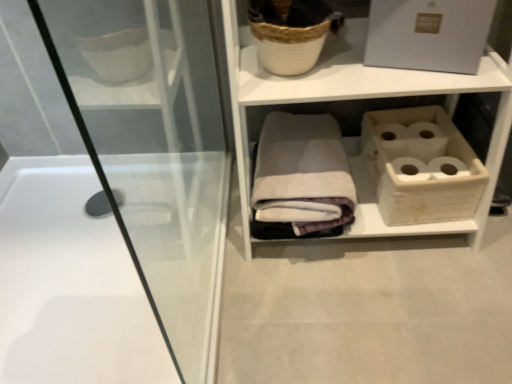
Question: Is white glossy bathtub at left further to camera compared to white woven basket at upper center?

Choices:
 (A) yes
 (B) no

Answer: (A)

Question: Considering the relative positions of white glossy bathtub at left and white woven basket at upper center in the image provided, is white glossy bathtub at left to the left of white woven basket at upper center from the viewer's perspective?

Choices:
 (A) no
 (B) yes

Answer: (B)

Question: Is white glossy bathtub at left aimed at white woven basket at upper center?

Choices:
 (A) no
 (B) yes

Answer: (A)

Question: Is white glossy bathtub at left positioned before white woven basket at upper center?

Choices:
 (A) yes
 (B) no

Answer: (B)

Question: Considering the relative sizes of white glossy bathtub at left and white woven basket at upper center in the image provided, is white glossy bathtub at left bigger than white woven basket at upper center?

Choices:
 (A) no
 (B) yes

Answer: (A)

Question: Is white glossy bathtub at left taller than white woven basket at upper center?

Choices:
 (A) yes
 (B) no

Answer: (B)

Question: From a real-world perspective, does white woven basket at upper center stand above white glossy bathtub at left?

Choices:
 (A) no
 (B) yes

Answer: (B)

Question: From a real-world perspective, is white woven basket at upper center beneath white glossy bathtub at left?

Choices:
 (A) no
 (B) yes

Answer: (A)

Question: Does white woven basket at upper center have a smaller size compared to white glossy bathtub at left?

Choices:
 (A) no
 (B) yes

Answer: (A)

Question: Is white woven basket at upper center turned away from white glossy bathtub at left?

Choices:
 (A) yes
 (B) no

Answer: (B)

Question: Is white woven basket at upper center shorter than white glossy bathtub at left?

Choices:
 (A) no
 (B) yes

Answer: (A)

Question: Is white woven basket at upper center located outside white glossy bathtub at left?

Choices:
 (A) yes
 (B) no

Answer: (A)

Question: Is gray cotton bath towel at center located within white glossy bathtub at left?

Choices:
 (A) no
 (B) yes

Answer: (A)